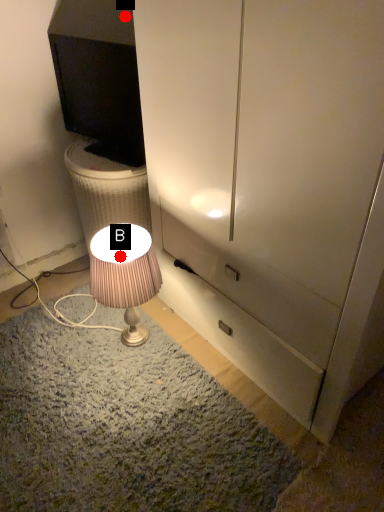
Question: Two points are circled on the image, labeled by A and B beside each circle. Which point is closer to the camera?

Choices:
 (A) A is closer
 (B) B is closer

Answer: (B)